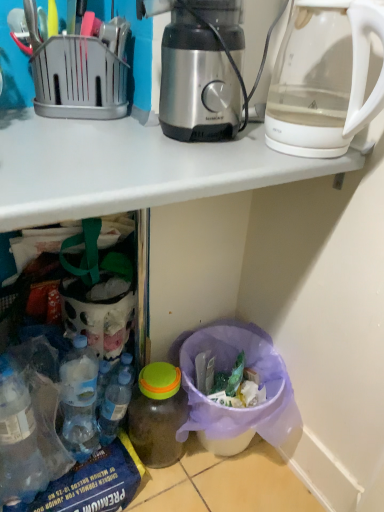
I want to click on free area in between stainless steel coffee maker at center and transparent glass kettle at upper right, so click(x=240, y=153).